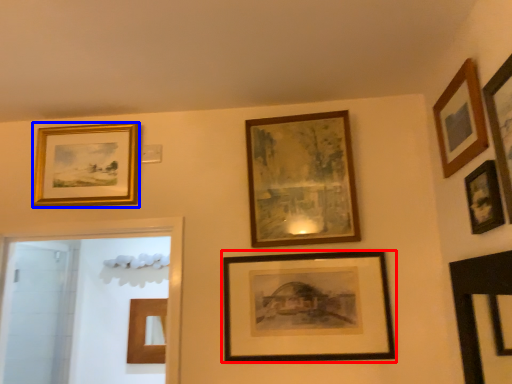
Question: Which object appears farthest to the camera in this image, picture frame (highlighted by a red box) or picture frame (highlighted by a blue box)?

Choices:
 (A) picture frame
 (B) picture frame

Answer: (B)